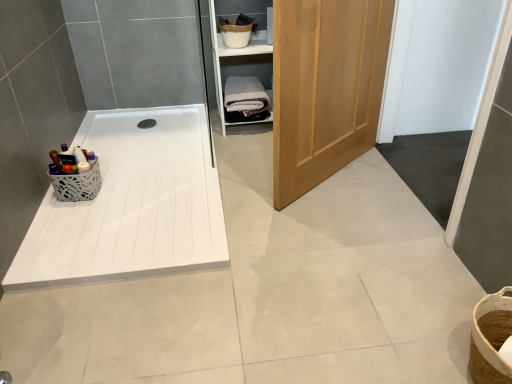
You are a GUI agent. You are given a task and a screenshot of the screen. Output one action in this format:
    pyautogui.click(x=<x>, y=<y>)
    Task: Click on the light brown wood door at center
    The image size is (512, 384).
    Given the screenshot: What is the action you would take?
    pyautogui.click(x=325, y=87)

This screenshot has height=384, width=512. I want to click on wooden cabinet at upper right, so click(238, 57).

This screenshot has width=512, height=384. What are the coordinates of `black rubber drain at center` in the screenshot? It's located at (147, 123).

Identify the location of white glossy bath at left. (131, 205).

The height and width of the screenshot is (384, 512). I want to click on light brown wood door at center, so click(325, 87).

Between white cotton bath towel at center and wooden cabinet at upper right, which one appears on the left side from the viewer's perspective?

white cotton bath towel at center.

Who is shorter, white cotton bath towel at center or wooden cabinet at upper right?

white cotton bath towel at center.

From the image's perspective, which is below, white cotton bath towel at center or wooden cabinet at upper right?

white cotton bath towel at center.

This screenshot has width=512, height=384. Identify the location of cabinetry located above the white cotton bath towel at center (from the image's perspective). (238, 57).

You are a GUI agent. You are given a task and a screenshot of the screen. Output one action in this format:
    pyautogui.click(x=<x>, y=<y>)
    Task: Click on the bath towel behind the white glossy bath at left
    The width and height of the screenshot is (512, 384).
    Given the screenshot: What is the action you would take?
    pyautogui.click(x=245, y=95)

Which of these two, white cotton bath towel at center or white glossy bath at left, is thinner?

Thinner between the two is white cotton bath towel at center.

From their relative heights in the image, would you say white cotton bath towel at center is taller or shorter than white glossy bath at left?

In the image, white cotton bath towel at center appears to be taller than white glossy bath at left.

From the image's perspective, would you say white cotton bath towel at center is shown under white glossy bath at left?

No.

From a real-world perspective, is white lace basket at left located beneath black rubber drain at center?

Incorrect, from a real-world perspective, white lace basket at left is higher than black rubber drain at center.

Is white lace basket at left aimed at black rubber drain at center?

No, white lace basket at left is not facing towards black rubber drain at center.

Is white lace basket at left bigger or smaller than black rubber drain at center?

white lace basket at left is bigger than black rubber drain at center.

Is light brown wood door at center outside of wooden cabinet at upper right?

light brown wood door at center lies outside wooden cabinet at upper right's area.

Does point (276, 185) come closer to viewer compared to point (218, 39)?

Yes, it is in front of point (218, 39).

Between light brown wood door at center and wooden cabinet at upper right, which one has larger size?

light brown wood door at center is bigger.

Can you tell me how much light brown wood door at center and white lace basket at left differ in facing direction?

The angle between the facing direction of light brown wood door at center and the facing direction of white lace basket at left is 51.1 degrees.

Do you think light brown wood door at center is within white lace basket at left, or outside of it?

light brown wood door at center is not enclosed by white lace basket at left.

Are light brown wood door at center and white lace basket at left making contact?

They are not placed beside each other.

Can you confirm if light brown wood door at center is taller than white lace basket at left?

Yes.

Find the location of a particular element. The image size is (512, 384). bath above the white lace basket at left (from the image's perspective) is located at coordinates (131, 205).

Considering the sizes of white lace basket at left and white glossy bath at left in the image, is white lace basket at left wider or thinner than white glossy bath at left?

white lace basket at left is thinner than white glossy bath at left.

Is the position of white lace basket at left more distant than that of white glossy bath at left?

Yes, white lace basket at left is further from the camera.

Can you confirm if white lace basket at left is taller than white glossy bath at left?

Indeed, white lace basket at left has a greater height compared to white glossy bath at left.

Is wooden cabinet at upper right thinner than white lace basket at left?

No.

Which object is more forward, wooden cabinet at upper right or white lace basket at left?

white lace basket at left is closer to the camera.

Is wooden cabinet at upper right to the left of white lace basket at left from the viewer's perspective?

No, wooden cabinet at upper right is not to the left of white lace basket at left.

Considering the sizes of objects wooden cabinet at upper right and white lace basket at left in the image provided, who is taller, wooden cabinet at upper right or white lace basket at left?

wooden cabinet at upper right.

The width and height of the screenshot is (512, 384). Identify the location of bath towel lying below the wooden cabinet at upper right (from the image's perspective). (245, 95).

Where is `bath towel behind the white glossy bath at left`? bath towel behind the white glossy bath at left is located at coordinates (245, 95).

Based on their spatial positions, is light brown wood door at center or white glossy bath at left further from white lace basket at left?

light brown wood door at center.

Based on their spatial positions, is black rubber drain at center or white glossy bath at left further from wooden cabinet at upper right?

white glossy bath at left is positioned further to the anchor wooden cabinet at upper right.

Based on their spatial positions, is black rubber drain at center or light brown wood door at center further from wooden cabinet at upper right?

The object further to wooden cabinet at upper right is light brown wood door at center.

Considering their positions, is light brown wood door at center positioned further to black rubber drain at center than white glossy bath at left?

light brown wood door at center lies further to black rubber drain at center than the other object.

Looking at this image, from the image, which object appears to be farther from light brown wood door at center, white lace basket at left or white cotton bath towel at center?

The object further to light brown wood door at center is white lace basket at left.

Considering their positions, is wooden cabinet at upper right positioned closer to light brown wood door at center than white lace basket at left?

Based on the image, wooden cabinet at upper right appears to be nearer to light brown wood door at center.

When comparing their distances from light brown wood door at center, does white lace basket at left or black rubber drain at center seem closer?

white lace basket at left is positioned closer to the anchor light brown wood door at center.

Looking at the image, which one is located closer to white glossy bath at left, white cotton bath towel at center or light brown wood door at center?

The object closer to white glossy bath at left is light brown wood door at center.

Where is `cabinetry between light brown wood door at center and black rubber drain at center from front to back`? cabinetry between light brown wood door at center and black rubber drain at center from front to back is located at coordinates (238, 57).

Locate an element on the screen. bath between white lace basket at left and light brown wood door at center is located at coordinates (131, 205).

You are a GUI agent. You are given a task and a screenshot of the screen. Output one action in this format:
    pyautogui.click(x=<x>, y=<y>)
    Task: Click on the bath towel between white lace basket at left and black rubber drain at center from front to back
    This screenshot has height=384, width=512.
    Given the screenshot: What is the action you would take?
    pyautogui.click(x=245, y=95)

Where is `bath towel between white lace basket at left and wooden cabinet at upper right in the horizontal direction`? bath towel between white lace basket at left and wooden cabinet at upper right in the horizontal direction is located at coordinates (245, 95).